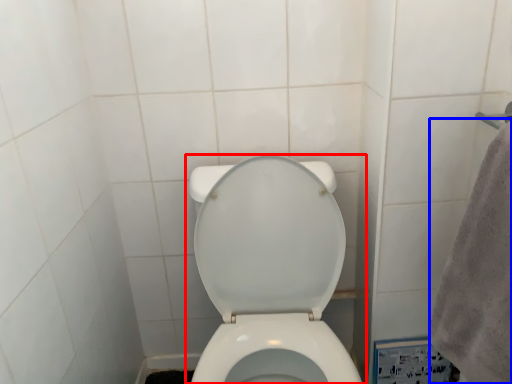
Question: Which object is closer to the camera taking this photo, toilet (highlighted by a red box) or bath towel (highlighted by a blue box)?

Choices:
 (A) toilet
 (B) bath towel

Answer: (B)